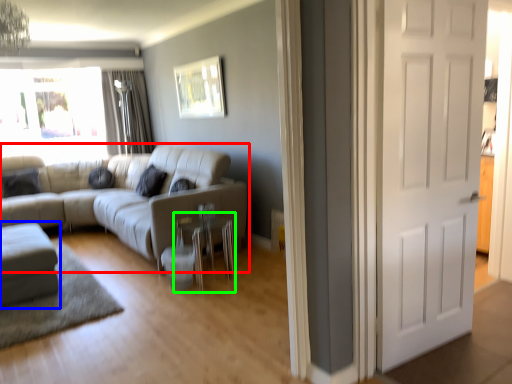
Question: Based on their relative distances, which object is nearer to studio couch (highlighted by a red box)? Choose from studio couch (highlighted by a blue box) and side table (highlighted by a green box).

Choices:
 (A) studio couch
 (B) side table

Answer: (B)